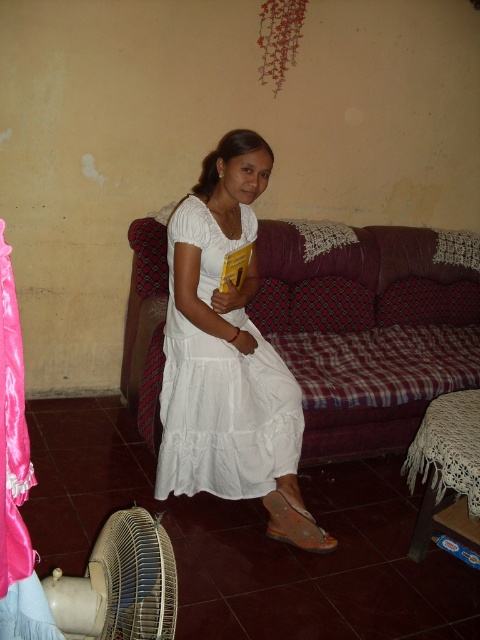
Question: Which object is closer to the camera taking this photo?

Choices:
 (A) brown leather sandal at lower center
 (B) white cotton dress at center

Answer: (B)

Question: Can you confirm if plaid fabric couch at center is bigger than brown leather sandal at lower center?

Choices:
 (A) no
 (B) yes

Answer: (B)

Question: Is plaid fabric couch at center wider than brown leather sandal at lower center?

Choices:
 (A) no
 (B) yes

Answer: (B)

Question: Can you confirm if plaid fabric couch at center is positioned to the right of beige plastic fan at lower left?

Choices:
 (A) no
 (B) yes

Answer: (B)

Question: Which object is the farthest from the beige plastic fan at lower left?

Choices:
 (A) white cotton dress at center
 (B) brown leather sandal at lower center

Answer: (B)

Question: Which is farther from the beige plastic fan at lower left?

Choices:
 (A) plaid fabric couch at center
 (B) white cotton dress at center
 (C) brown leather sandal at lower center

Answer: (A)